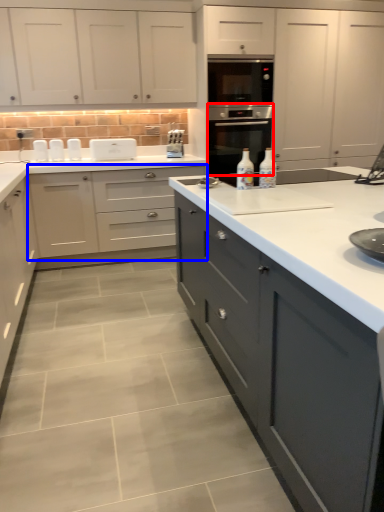
Question: Which point is further to the camera, home appliance (highlighted by a red box) or cabinetry (highlighted by a blue box)?

Choices:
 (A) home appliance
 (B) cabinetry

Answer: (A)